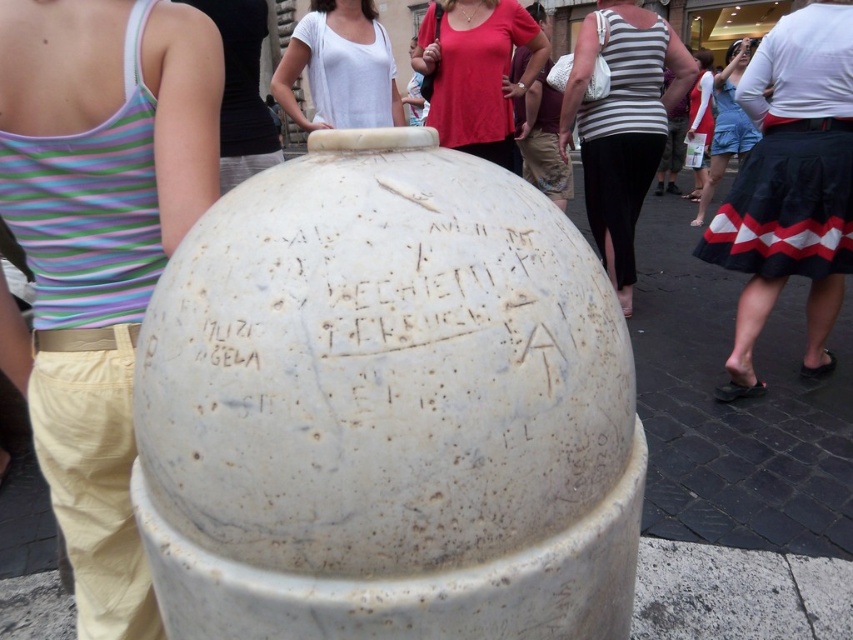
Question: Which of the following is the farthest from the observer?

Choices:
 (A) black fabric tank top at upper left
 (B) striped tank top at center
 (C) denim shorts at center

Answer: (C)

Question: Which point is closer to the camera taking this photo?

Choices:
 (A) (445, 131)
 (B) (352, 20)
 (C) (209, 13)
 (D) (729, 77)

Answer: (C)

Question: Is the position of striped tank top at center less distant than that of black and white zigzag skirt at center?

Choices:
 (A) yes
 (B) no

Answer: (A)

Question: Where is white marble vase at center located in relation to black fabric tank top at upper left in the image?

Choices:
 (A) left
 (B) right

Answer: (B)

Question: From the image, what is the correct spatial relationship of striped tank top at center in relation to white cotton tank top at upper center?

Choices:
 (A) below
 (B) above

Answer: (A)

Question: Which point is closer to the camera?

Choices:
 (A) (729, 220)
 (B) (231, 445)
 (C) (219, 160)
 (D) (456, 54)

Answer: (B)